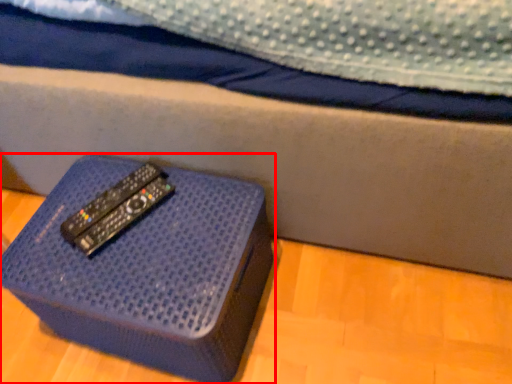
Question: From the image, what is the correct spatial relationship of furniture (annotated by the red box) in relation to remote?

Choices:
 (A) right
 (B) left

Answer: (A)